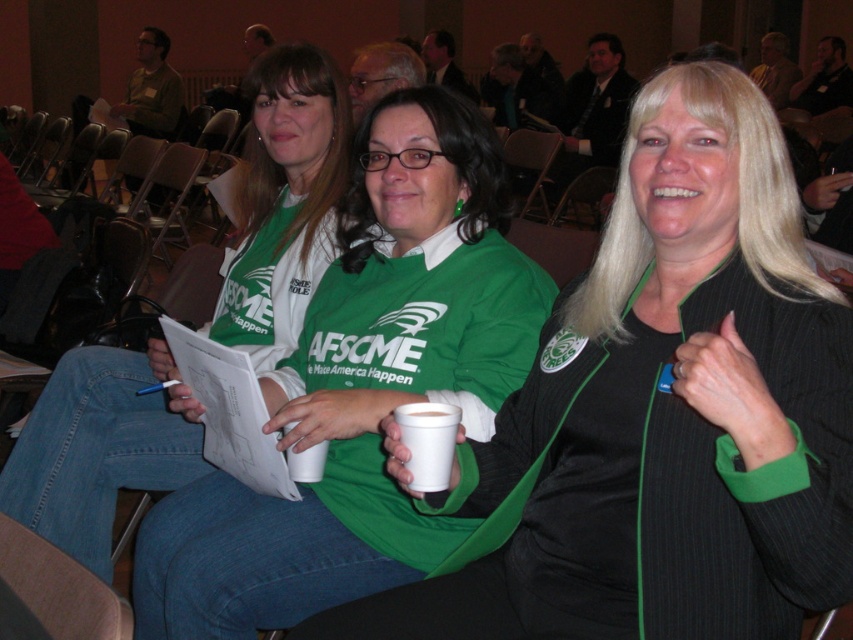
Question: Can you confirm if green fabric shirt at center is positioned to the right of white styrofoam cup at center?

Choices:
 (A) no
 (B) yes

Answer: (B)

Question: Which point is closer to the camera?

Choices:
 (A) (448, 252)
 (B) (671, 132)
 (C) (418, 406)

Answer: (B)

Question: Does matte green t-shirt at center come behind white styrofoam cup at center?

Choices:
 (A) no
 (B) yes

Answer: (B)

Question: Observing the image, what is the correct spatial positioning of green fabric shirt at center in reference to matte green t-shirt at center?

Choices:
 (A) above
 (B) below

Answer: (B)

Question: Which point is closer to the camera taking this photo?

Choices:
 (A) (387, 134)
 (B) (445, 470)
 (C) (799, 595)

Answer: (C)

Question: Estimate the real-world distances between objects in this image. Which object is farther from the matte green t-shirt at center?

Choices:
 (A) white styrofoam cup at center
 (B) green fabric shirt at center
 (C) green matte shirt at center

Answer: (A)